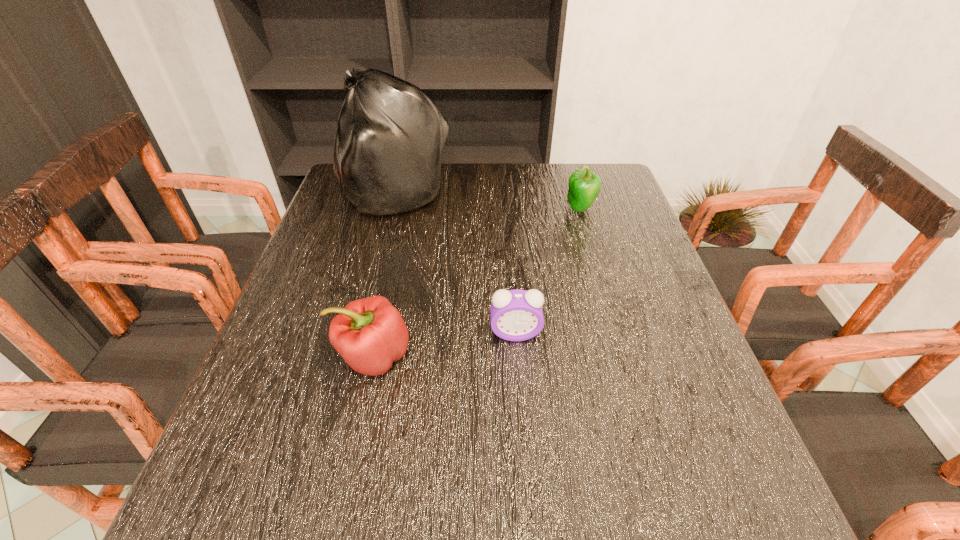
Locate an element on the screen. The width and height of the screenshot is (960, 540). the tallest object is located at coordinates (388, 147).

What are the coordinates of `the rightmost object` in the screenshot? It's located at (584, 186).

The height and width of the screenshot is (540, 960). In order to click on the right bell pepper in this screenshot , I will do `click(584, 186)`.

At what (x,y) coordinates should I click in order to perform the action: click on the left bell pepper. Please return your answer as a coordinate pair (x, y). Looking at the image, I should click on (370, 334).

Image resolution: width=960 pixels, height=540 pixels. I want to click on the second object from right to left, so click(x=516, y=315).

At what (x,y) coordinates should I click in order to perform the action: click on alarm clock. Please return your answer as a coordinate pair (x, y). The image size is (960, 540). Looking at the image, I should click on tap(516, 315).

Identify the location of free space located 0.340m on the front of the tallest object. The image size is (960, 540). (362, 320).

Where is `vacant region located on the back of the rightmost object`? vacant region located on the back of the rightmost object is located at coordinates (573, 183).

At what (x,y) coordinates should I click in order to perform the action: click on vacant space located 0.220m on the front of the left bell pepper. Please return your answer as a coordinate pair (x, y). This screenshot has width=960, height=540. Looking at the image, I should click on (338, 516).

Find the location of a particular element. vacant space located on the face of the third object from left to right is located at coordinates (526, 472).